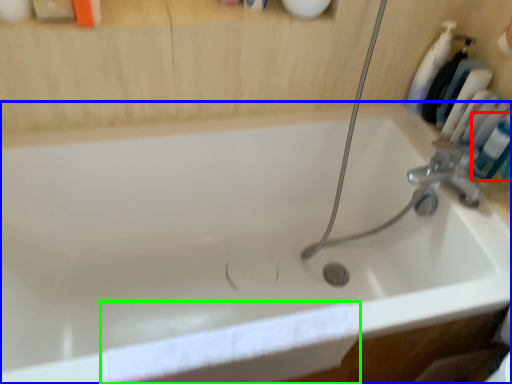
Question: Which is nearer to the mouthwash (highlighted by a red box)? bathtub (highlighted by a blue box) or bath towel (highlighted by a green box).

Choices:
 (A) bathtub
 (B) bath towel

Answer: (A)